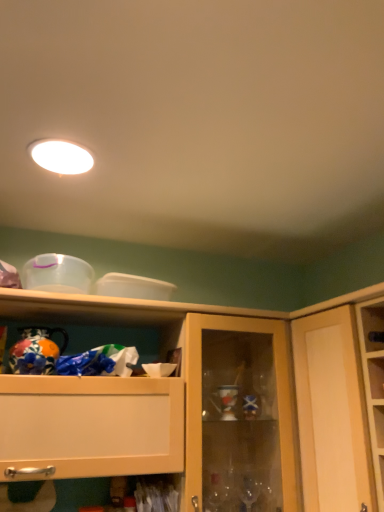
Question: Considering the relative positions of wooden cabinet at upper center and hand-painted ceramic vase at left in the image provided, is wooden cabinet at upper center to the right of hand-painted ceramic vase at left from the viewer's perspective?

Choices:
 (A) yes
 (B) no

Answer: (A)

Question: Does wooden cabinet at upper center lie behind hand-painted ceramic vase at left?

Choices:
 (A) no
 (B) yes

Answer: (A)

Question: Does wooden cabinet at upper center have a greater width compared to hand-painted ceramic vase at left?

Choices:
 (A) yes
 (B) no

Answer: (A)

Question: From a real-world perspective, is wooden cabinet at upper center physically below hand-painted ceramic vase at left?

Choices:
 (A) yes
 (B) no

Answer: (A)

Question: Is wooden cabinet at upper center surrounding hand-painted ceramic vase at left?

Choices:
 (A) yes
 (B) no

Answer: (A)

Question: Is matte wood cupboard at right in front of or behind hand-painted ceramic vase at left in the image?

Choices:
 (A) behind
 (B) front

Answer: (B)

Question: Would you say matte wood cupboard at right is to the left or to the right of hand-painted ceramic vase at left in the picture?

Choices:
 (A) left
 (B) right

Answer: (B)

Question: From a real-world perspective, is matte wood cupboard at right physically located above or below hand-painted ceramic vase at left?

Choices:
 (A) below
 (B) above

Answer: (A)

Question: From the image's perspective, is matte wood cupboard at right located above or below hand-painted ceramic vase at left?

Choices:
 (A) above
 (B) below

Answer: (B)

Question: Is point (319, 339) closer or farther from the camera than point (364, 430)?

Choices:
 (A) farther
 (B) closer

Answer: (A)

Question: In terms of width, does matte wood cupboard at right look wider or thinner when compared to wooden cabinet at upper center?

Choices:
 (A) thin
 (B) wide

Answer: (A)

Question: Is matte wood cupboard at right in front of or behind wooden cabinet at upper center in the image?

Choices:
 (A) front
 (B) behind

Answer: (A)

Question: Looking at the image, does matte wood cupboard at right seem bigger or smaller compared to wooden cabinet at upper center?

Choices:
 (A) big
 (B) small

Answer: (B)

Question: From a real-world perspective, is white glossy light fixture at upper center positioned above or below hand-painted ceramic vase at left?

Choices:
 (A) above
 (B) below

Answer: (A)

Question: In terms of width, does white glossy light fixture at upper center look wider or thinner when compared to hand-painted ceramic vase at left?

Choices:
 (A) wide
 (B) thin

Answer: (A)